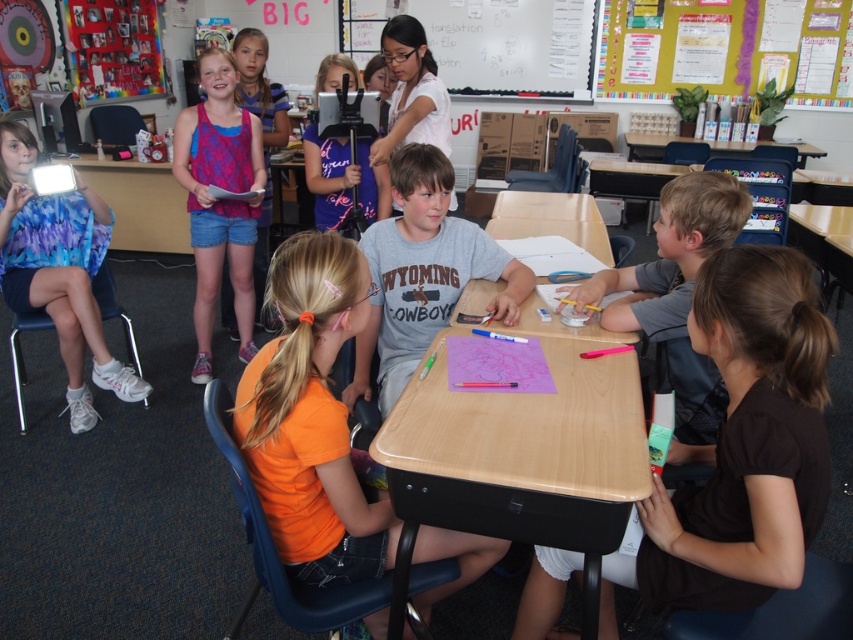
Consider the image. You are standing in the classroom and want to hand a note to the child wearing the brown matte shirt at lower right. Based on the spatial coordinates provided, which direction should you move to reach them?

The brown matte shirt at lower right is located at point (746, 440), which corresponds to the lower right area of the image. To reach them, you should move towards the lower right direction from your current position.

You are a teacher observing the classroom scene. You notice two students wearing the gray matte shirt at right and the matte pink tank top at upper left. Which student do you think has a wider torso? Explain your reasoning based on the clothing details.

The matte pink tank top at upper left has a wider torso because the gray matte shirt at right is thinner than it, indicating that the shirt is narrower in width.